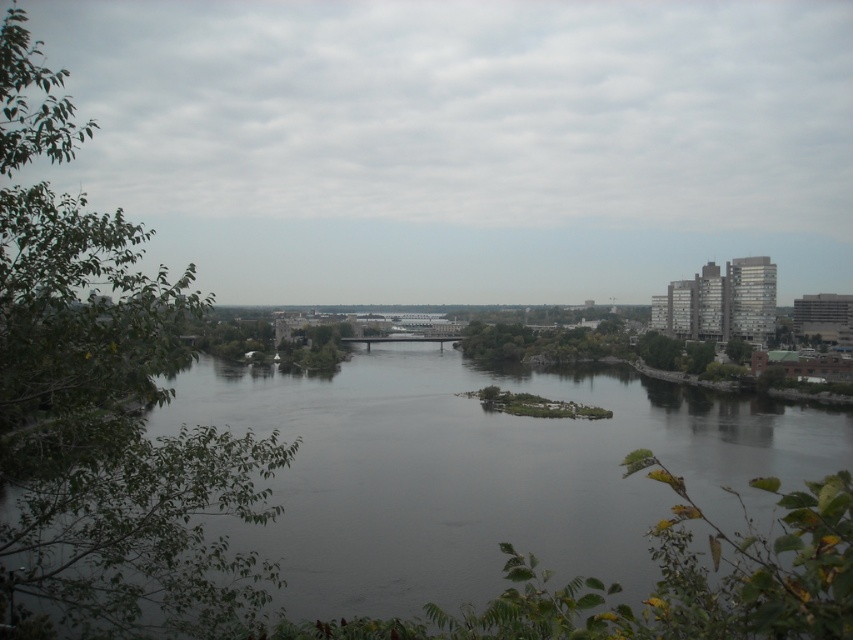
Question: Does dark gray water at center have a smaller size compared to green leafy tree at left?

Choices:
 (A) no
 (B) yes

Answer: (B)

Question: Where is dark gray water at center located in relation to green leafy tree at left in the image?

Choices:
 (A) below
 (B) above

Answer: (A)

Question: Among these objects, which one is nearest to the camera?

Choices:
 (A) green leafy tree at left
 (B) dark gray water at center

Answer: (A)

Question: Does dark gray water at center appear over green leafy tree at left?

Choices:
 (A) no
 (B) yes

Answer: (A)